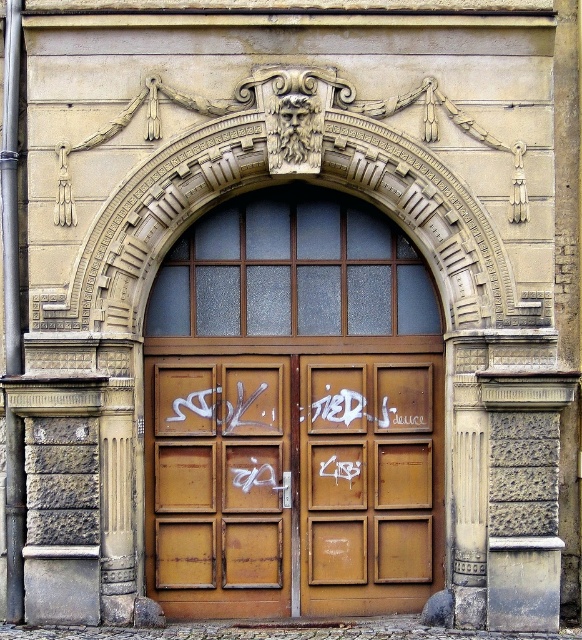
Consider the image. You are standing in front of the building and notice the rusty wooden door at center. If you were to walk directly towards the door, which direction should you move relative to your current position?

Since the rusty wooden door at center is located at point coordinates, you should move directly forward towards the center of the building to reach it.

structural integrity of the door is crucial for safety. You are an inspector checking the building. You see the rusty metal doors at center and the rusty wooden door at center. Which door should you prioritize inspecting first based on their positions?

structural integrity of the door is crucial for safety. You are an inspector checking the building. You see the rusty metal doors at center and the rusty wooden door at center. Which door should you prioritize inspecting first based on their positions? The rusty metal doors at center are to the right of the rusty wooden door at center. Since the wooden door is positioned to the left, it might be more exposed to environmental factors like moisture, leading to faster deterioration. Therefore, the rusty wooden